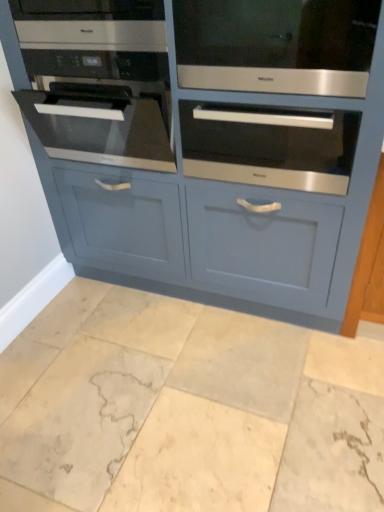
Image resolution: width=384 pixels, height=512 pixels. I want to click on free space above marble tile at lower center (from a real-world perspective), so click(163, 384).